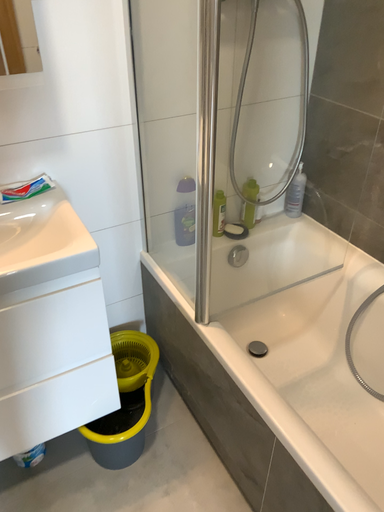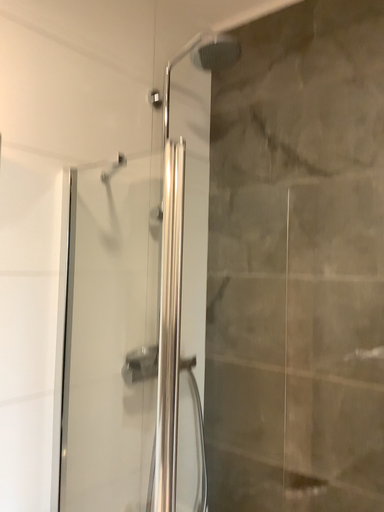
Question: Which way did the camera rotate in the video?

Choices:
 (A) rotated right
 (B) rotated left

Answer: (A)